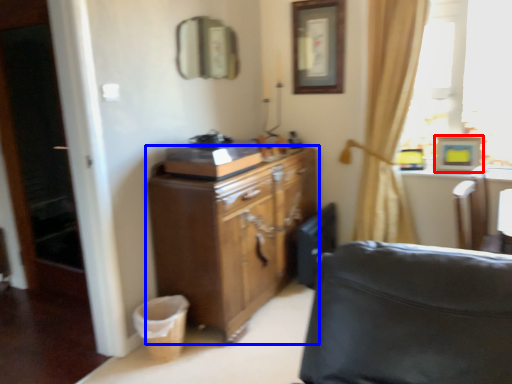
Question: Which point is closer to the camera, picture frame (highlighted by a red box) or cabinetry (highlighted by a blue box)?

Choices:
 (A) picture frame
 (B) cabinetry

Answer: (B)